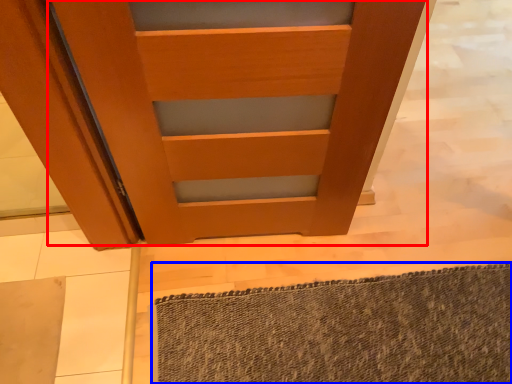
Question: Which point is closer to the camera, door (highlighted by a red box) or bath mat (highlighted by a blue box)?

Choices:
 (A) door
 (B) bath mat

Answer: (A)